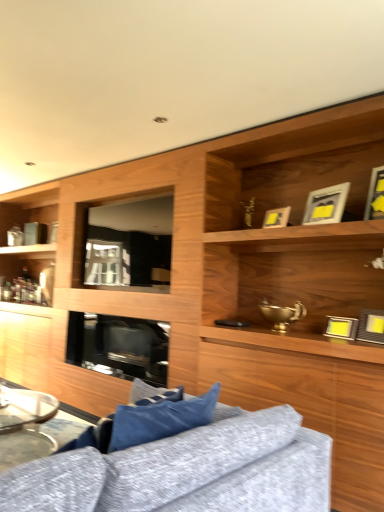
Question: Is yellow matte picture frame at right, which is counted as the fourth picture frame, starting from the top, situated inside textured gray fabric couch at lower center or outside?

Choices:
 (A) outside
 (B) inside

Answer: (A)

Question: Based on their positions, is yellow matte picture frame at right, the 2th picture frame from the bottom, located to the left or right of textured gray fabric couch at lower center?

Choices:
 (A) left
 (B) right

Answer: (B)

Question: Which object is the closest to the matte gold picture frame at upper center, which ranks as the 3th picture frame in bottom-to-top order?

Choices:
 (A) metallic silver tray at lower left
 (B) matte yellow picture frame at upper right, arranged as the 5th picture frame when ordered from the bottom
 (C) black glass fireplace at center
 (D) yellow matte picture frame at right, the 2th picture frame from the bottom
 (E) metallic silver picture frame at right, marked as the fifth picture frame in a top-to-bottom arrangement

Answer: (B)

Question: Estimate the real-world distances between objects in this image. Which object is closer to the black glass fireplace at center?

Choices:
 (A) metallic silver tray at lower left
 (B) yellow matte picture frame at right, which is counted as the fourth picture frame, starting from the top
 (C) matte yellow picture frame at upper right, arranged as the 5th picture frame when ordered from the bottom
 (D) textured gray fabric couch at lower center
 (E) matte gold picture frame at upper right, which is counted as the 2th picture frame, starting from the top

Answer: (A)